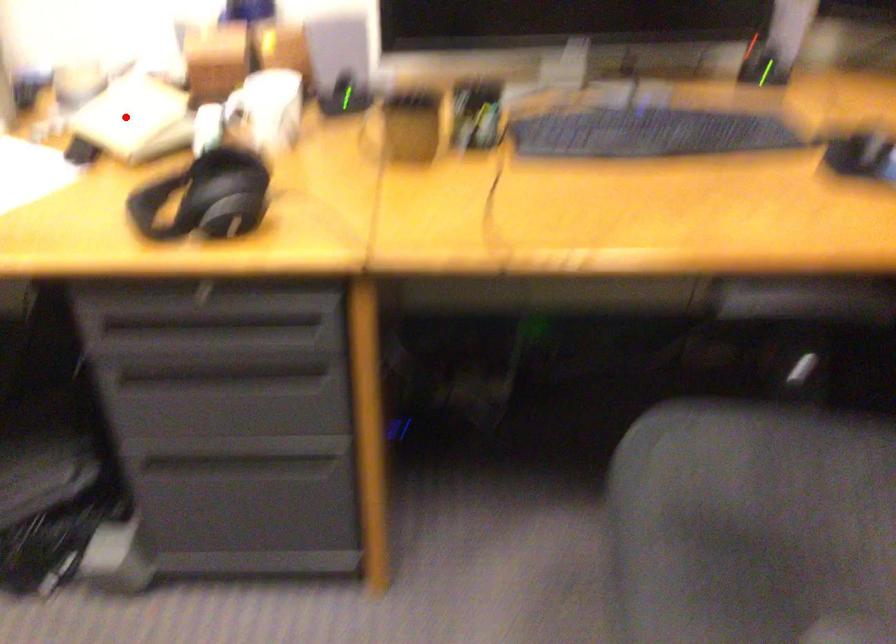
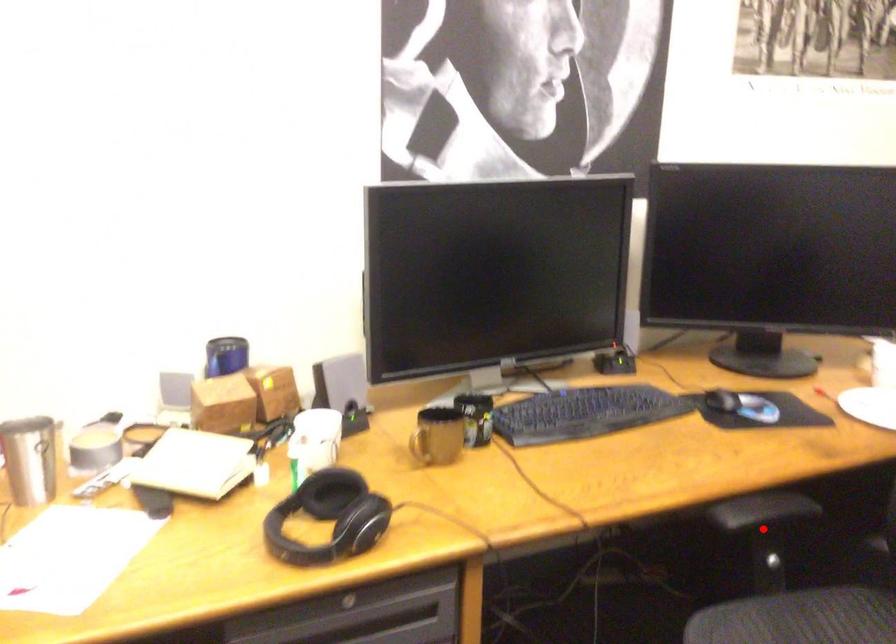
I am providing you with two images of the same scene from different viewpoints. A red point is marked on the first image and another point is marked on the second image. Are the points marked in image1 and image2 representing the same 3D position?

No